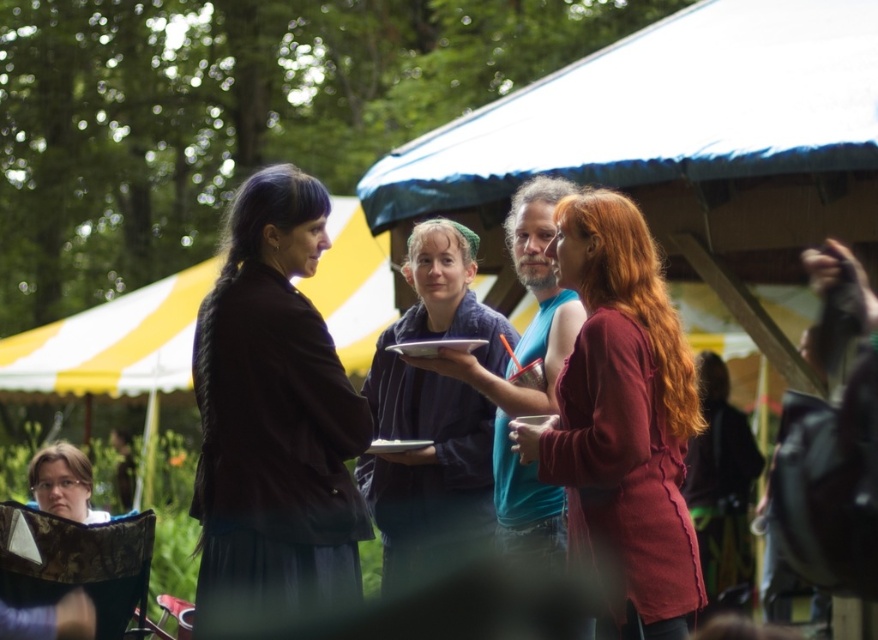
You are at the lively outdoor gathering and want to take a photo of both the point at coordinates (x=379, y=467) and the point at (x=59, y=445). Which point should you focus on first to ensure both are in clear view?

You should focus on point (x=379, y=467) first since it is closer to the camera than point (x=59, y=445), ensuring both points are in focus.

What is the color of the object located at the coordinates point (432, 413) in the image?

The object at point (432, 413) is dark blue fabric at center.